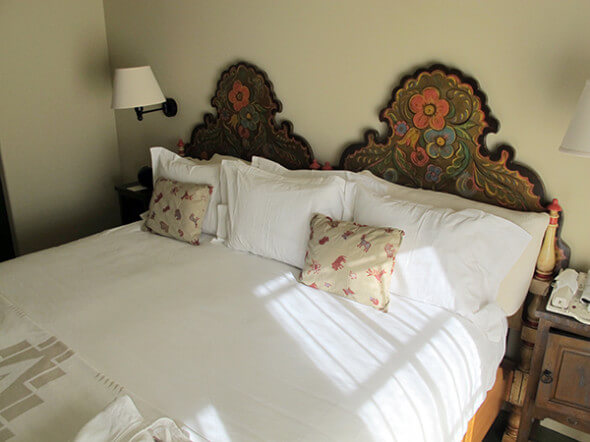
Identify the location of bed sheet. The height and width of the screenshot is (442, 590). (209, 342), (114, 284), (281, 369).